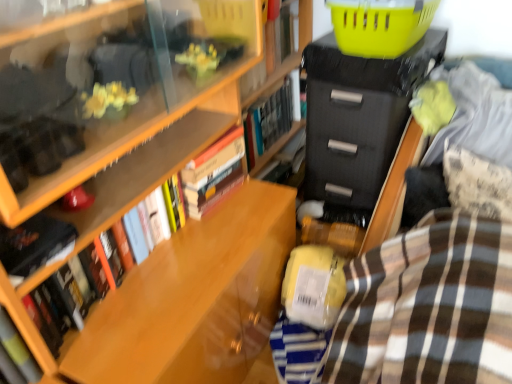
Question: Can you confirm if hardcover book at lower left, the fifth book from the back, is positioned to the right of wooden bookshelf at center, which is counted as the third book, starting from the back?

Choices:
 (A) yes
 (B) no

Answer: (B)

Question: From a real-world perspective, is hardcover book at lower left, the fifth book from the back, located beneath wooden bookshelf at center, which is counted as the third book, starting from the back?

Choices:
 (A) yes
 (B) no

Answer: (B)

Question: Is hardcover book at lower left, the 1th book in the front-to-back sequence, surrounding wooden bookshelf at center, which is the third book from front to back?

Choices:
 (A) yes
 (B) no

Answer: (B)

Question: Considering the relative positions of hardcover book at lower left, the 1th book in the front-to-back sequence, and wooden bookshelf at center, which is counted as the third book, starting from the back, in the image provided, is hardcover book at lower left, the 1th book in the front-to-back sequence, in front of wooden bookshelf at center, which is counted as the third book, starting from the back,?

Choices:
 (A) yes
 (B) no

Answer: (A)

Question: Considering the relative sizes of hardcover book at lower left, the fifth book from the back, and wooden bookshelf at center, which is the third book from front to back, in the image provided, is hardcover book at lower left, the fifth book from the back, shorter than wooden bookshelf at center, which is the third book from front to back,?

Choices:
 (A) yes
 (B) no

Answer: (B)

Question: Does hardcover book at lower left, the fifth book from the back, have a lesser width compared to wooden bookshelf at center, which is counted as the third book, starting from the back?

Choices:
 (A) no
 (B) yes

Answer: (A)

Question: Does wooden bookshelf at center, which is the third book from front to back, have a smaller size compared to hardcover book at left, positioned as the second book in front-to-back order?

Choices:
 (A) yes
 (B) no

Answer: (B)

Question: Does wooden bookshelf at center, which is counted as the third book, starting from the back, lie in front of hardcover book at left, the 4th book from the back?

Choices:
 (A) yes
 (B) no

Answer: (B)

Question: Could hardcover book at left, the 4th book from the back, be considered to be inside wooden bookshelf at center, which is counted as the third book, starting from the back?

Choices:
 (A) no
 (B) yes

Answer: (A)

Question: Does wooden bookshelf at center, which is the third book from front to back, turn towards hardcover book at left, positioned as the second book in front-to-back order?

Choices:
 (A) yes
 (B) no

Answer: (B)

Question: From a real-world perspective, is wooden bookshelf at center, which is counted as the third book, starting from the back, physically above hardcover book at left, positioned as the second book in front-to-back order?

Choices:
 (A) yes
 (B) no

Answer: (B)

Question: Can you confirm if wooden bookshelf at center, which is counted as the third book, starting from the back, is taller than hardcover book at left, positioned as the second book in front-to-back order?

Choices:
 (A) no
 (B) yes

Answer: (B)

Question: Is brown striped blanket at lower right to the left of hardcover book at upper center, the second book in the back-to-front sequence, from the viewer's perspective?

Choices:
 (A) no
 (B) yes

Answer: (A)